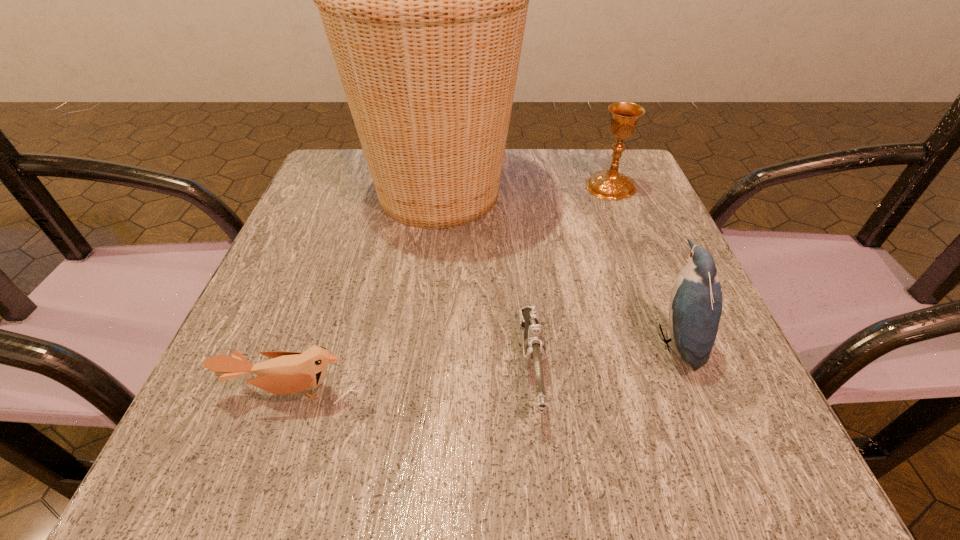
Find the location of a particular element. The height and width of the screenshot is (540, 960). basket is located at coordinates (423, 0).

Image resolution: width=960 pixels, height=540 pixels. Find the location of `chalice`. chalice is located at coordinates (610, 184).

In order to click on the taller bird in this screenshot , I will do `click(695, 310)`.

At what (x,y) coordinates should I click in order to perform the action: click on the shorter bird. Please return your answer as a coordinate pair (x, y). Looking at the image, I should click on (288, 372).

Find the location of a particular element. gun is located at coordinates (534, 345).

Where is `vacant space located on the front of the basket`? Image resolution: width=960 pixels, height=540 pixels. vacant space located on the front of the basket is located at coordinates (429, 276).

Identify the location of vacant space located on the back of the chalice. (596, 150).

The image size is (960, 540). What are the coordinates of `vacant region located 0.360m at the tip of the right bird's beak` in the screenshot? It's located at click(420, 340).

What are the coordinates of `free space located 0.340m at the tip of the right bird's beak` in the screenshot? It's located at (433, 340).

Find the location of a particular element. The width and height of the screenshot is (960, 540). vacant space located 0.340m at the tip of the right bird's beak is located at coordinates (433, 340).